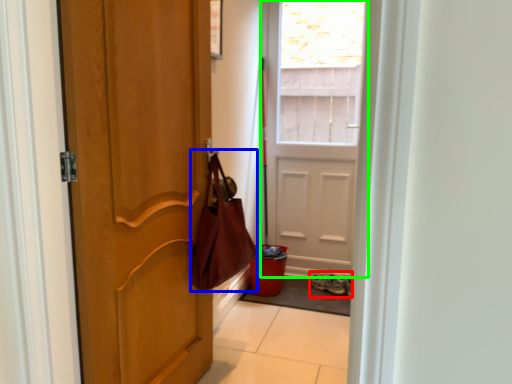
Question: Estimate the real-world distances between objects in this image. Which object is farther from footwear (highlighted by a red box), shoulder bag (highlighted by a blue box) or door (highlighted by a green box)?

Choices:
 (A) shoulder bag
 (B) door

Answer: (A)